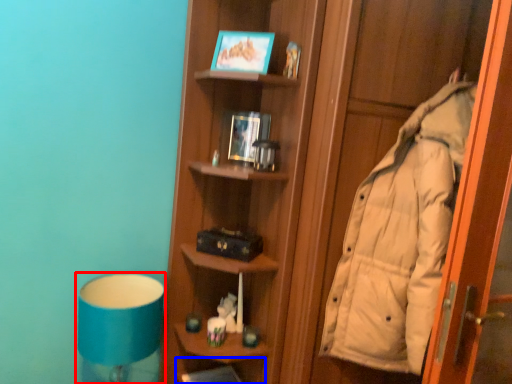
Question: Among these objects, which one is nearest to the camera, bedside lamp (highlighted by a red box) or shelf (highlighted by a blue box)?

Choices:
 (A) bedside lamp
 (B) shelf

Answer: (A)